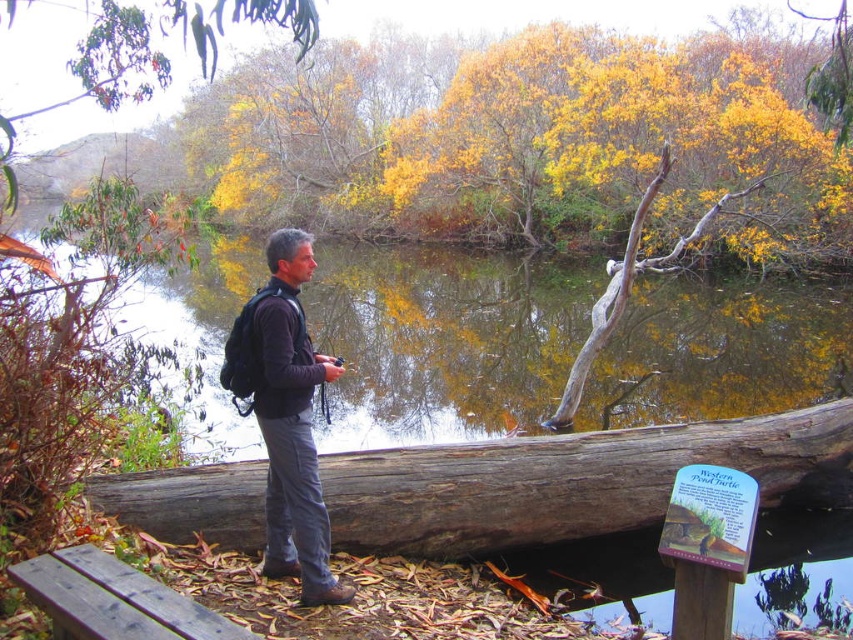
You are a photographer carrying a tripod that is 3 feet wide. You want to set up your equipment between the weathered wood log at center and the wooden bench at lower left. Is there enough space for your tripod?

The weathered wood log at center and wooden bench at lower left are 8.14 feet apart from each other, so yes, there is enough space to place the tripod between them since 8.14 feet is greater than the tripod width of 3 feet.